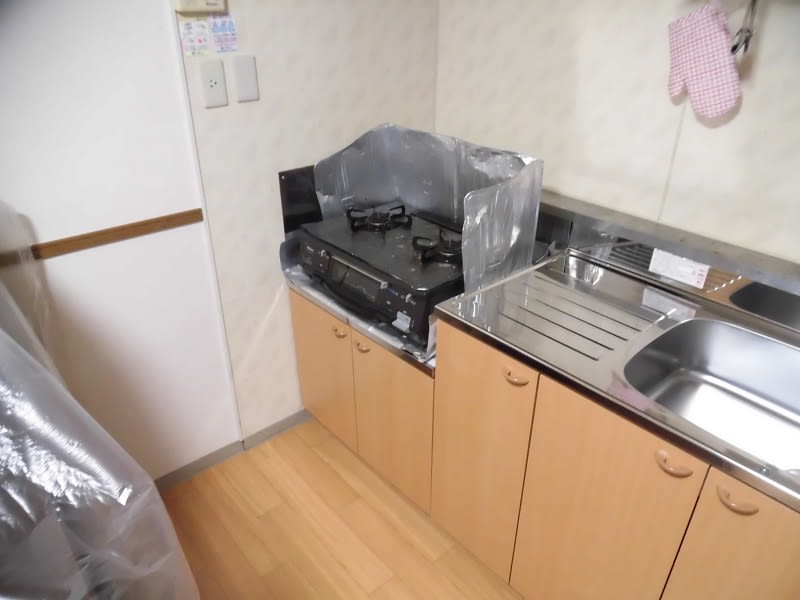
You are a GUI agent. You are given a task and a screenshot of the screen. Output one action in this format:
    pyautogui.click(x=<x>, y=<y>)
    Task: Click on the cabinet handle
    The image size is (800, 600).
    Given the screenshot: What is the action you would take?
    (x=334, y=332), (x=362, y=348), (x=513, y=377), (x=673, y=477), (x=728, y=500)